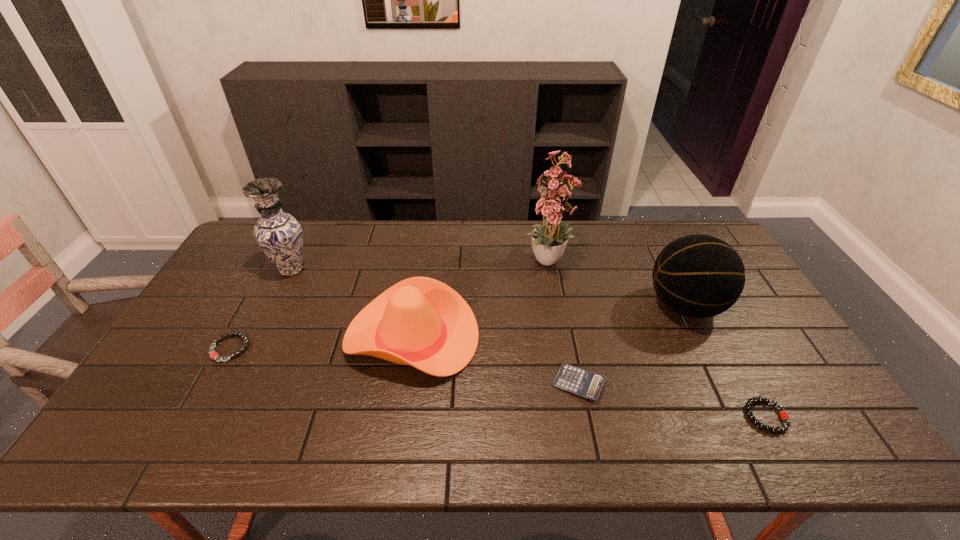
Where is `basketball that is positioned at the right edge`? The image size is (960, 540). basketball that is positioned at the right edge is located at coordinates coord(699,276).

At what (x,y) coordinates should I click in order to perform the action: click on bracelet that is positioned at the right edge. Please return your answer as a coordinate pair (x, y). The width and height of the screenshot is (960, 540). Looking at the image, I should click on (784, 415).

Image resolution: width=960 pixels, height=540 pixels. Identify the location of object that is at the far left corner. (279, 234).

You are a GUI agent. You are given a task and a screenshot of the screen. Output one action in this format:
    pyautogui.click(x=<x>, y=<y>)
    Task: Click on the object present at the near right corner
    The height and width of the screenshot is (540, 960).
    Given the screenshot: What is the action you would take?
    pyautogui.click(x=784, y=415)

At what (x,y) coordinates should I click in order to perform the action: click on vacant space at the far edge. Please return your answer as a coordinate pair (x, y). Looking at the image, I should click on (470, 240).

In order to click on free region at the near edge of the desktop in this screenshot , I will do `click(328, 422)`.

This screenshot has width=960, height=540. I want to click on free space at the left edge of the desktop, so click(195, 401).

I want to click on vacant space at the right edge of the desktop, so click(809, 414).

Where is `vacant position at the near left corner of the desktop`? vacant position at the near left corner of the desktop is located at coordinates (130, 447).

Where is `vacant space that's between the flower arrangement and the vase`? vacant space that's between the flower arrangement and the vase is located at coordinates (420, 266).